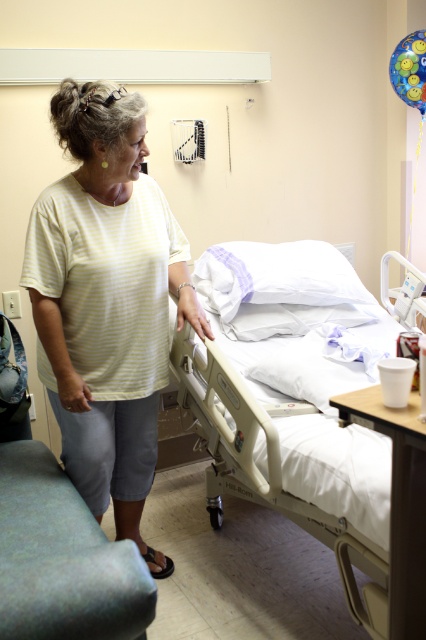
Between yellow striped shirt at center and beige plastic hospital bed at center, which one has less height?

Standing shorter between the two is beige plastic hospital bed at center.

Can you confirm if yellow striped shirt at center is wider than beige plastic hospital bed at center?

No.

At what (x,y) coordinates should I click in order to perform the action: click on yellow striped shirt at center. Please return your answer as a coordinate pair (x, y). This screenshot has width=426, height=640. Looking at the image, I should click on click(x=106, y=301).